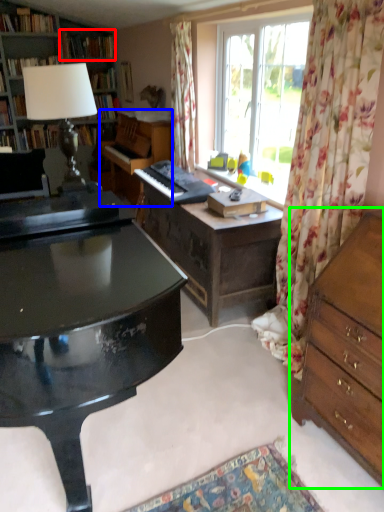
Question: Considering the real-world distances, which object is closest to book (highlighted by a red box)? piano (highlighted by a blue box) or chest of drawers (highlighted by a green box).

Choices:
 (A) piano
 (B) chest of drawers

Answer: (A)